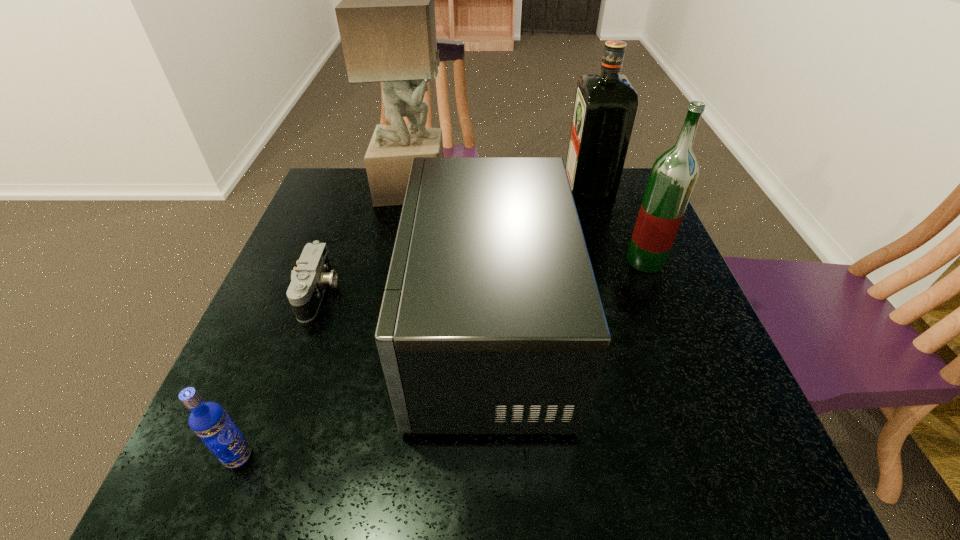
Locate an element on the screen. The width and height of the screenshot is (960, 540). vacant region located on the front label of the farther liquor is located at coordinates (464, 190).

Identify the location of free space located 0.370m on the back of the nearer liquor. (610, 173).

Where is `vacant space situated 0.220m on the front-facing side of the microwave oven`? This screenshot has height=540, width=960. vacant space situated 0.220m on the front-facing side of the microwave oven is located at coordinates (300, 332).

Where is `vacant position located on the front-facing side of the microwave oven`? The width and height of the screenshot is (960, 540). vacant position located on the front-facing side of the microwave oven is located at coordinates (267, 332).

Identify the location of vacant position located on the front-facing side of the microwave oven. The height and width of the screenshot is (540, 960). (376, 332).

Locate an element on the screen. The height and width of the screenshot is (540, 960). vacant space located 0.280m on the right of the vodka is located at coordinates (420, 456).

Where is `free space located on the lens of the shortest object`? The width and height of the screenshot is (960, 540). free space located on the lens of the shortest object is located at coordinates (433, 293).

Where is `sculpture that is at the far edge`? sculpture that is at the far edge is located at coordinates (386, 19).

What are the coordinates of `liquor situated at the far edge` in the screenshot? It's located at (605, 108).

Locate an element on the screen. The height and width of the screenshot is (540, 960). object at the near edge is located at coordinates (209, 421).